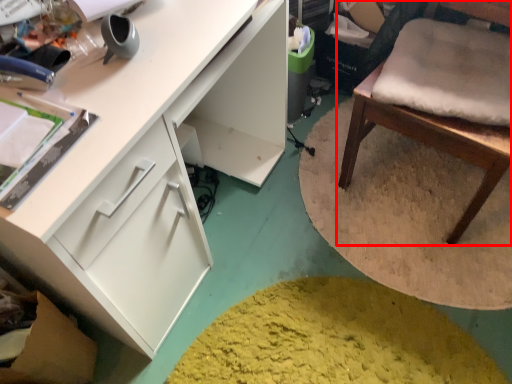
Question: Observing the image, what is the correct spatial positioning of chair (annotated by the red box) in reference to cabinetry?

Choices:
 (A) right
 (B) left

Answer: (A)